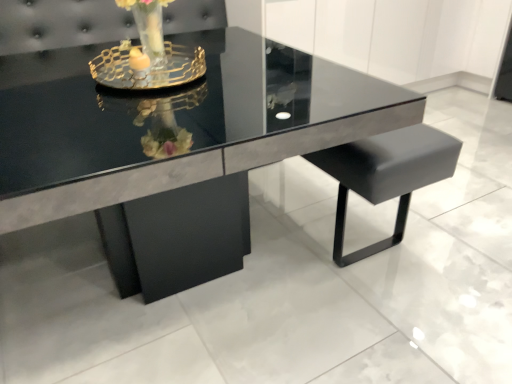
Question: Is glossy black table at center in front of or behind gold metallic candle holder at upper center in the image?

Choices:
 (A) behind
 (B) front

Answer: (B)

Question: Is point (x=287, y=104) positioned closer to the camera than point (x=170, y=84)?

Choices:
 (A) closer
 (B) farther

Answer: (B)

Question: Considering the positions of glossy black table at center and gold metallic candle holder at upper center in the image, is glossy black table at center taller or shorter than gold metallic candle holder at upper center?

Choices:
 (A) tall
 (B) short

Answer: (A)

Question: From their relative heights in the image, would you say gold metallic candle holder at upper center is taller or shorter than glossy black table at center?

Choices:
 (A) tall
 (B) short

Answer: (B)

Question: Would you say gold metallic candle holder at upper center is inside or outside glossy black table at center?

Choices:
 (A) inside
 (B) outside

Answer: (B)

Question: Is point (166, 49) closer or farther from the camera than point (30, 59)?

Choices:
 (A) farther
 (B) closer

Answer: (A)

Question: In terms of size, does gold metallic candle holder at upper center appear bigger or smaller than glossy black table at center?

Choices:
 (A) big
 (B) small

Answer: (B)